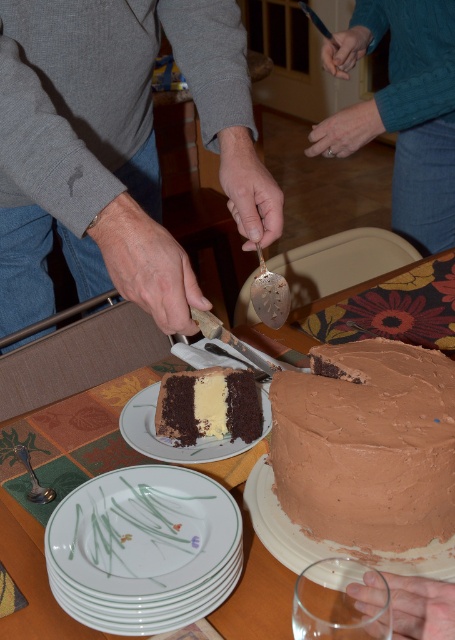
Question: Which object appears closest to the camera in this image?

Choices:
 (A) white porcelain plate at lower left
 (B) wooden handle knife at center

Answer: (A)

Question: Does blue knitted sweater at upper right have a greater width compared to chocolatesmoothcake at center?

Choices:
 (A) no
 (B) yes

Answer: (B)

Question: Which of the following is the farthest from the observer?

Choices:
 (A) chocolatesmoothcake at center
 (B) chocolate matte cake at center
 (C) smooth brown cake at center

Answer: (A)

Question: Which point is farther to the camera?

Choices:
 (A) chocolate matte cake at center
 (B) brown matte cake at center
 (C) blue knitted sweater at upper right
 (D) smooth brown cake at center

Answer: (C)

Question: Can you confirm if white porcelain plate at lower left is thinner than wooden handle knife at center?

Choices:
 (A) yes
 (B) no

Answer: (B)

Question: Can you confirm if gray cotton sweater at upper left is positioned to the left of white porcelain plate at lower left?

Choices:
 (A) yes
 (B) no

Answer: (A)